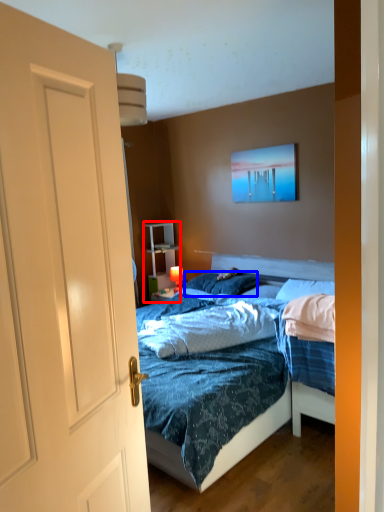
Question: Which of the following is the farthest to the observer, armoire (highlighted by a red box) or pillow (highlighted by a blue box)?

Choices:
 (A) armoire
 (B) pillow

Answer: (A)